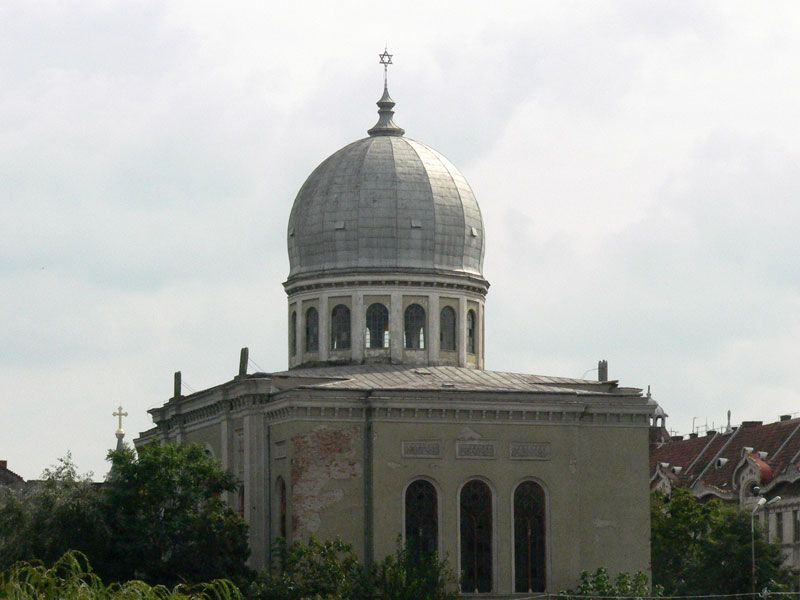
Identify the location of short arched windows. (294, 334), (316, 331), (342, 320), (378, 319), (410, 323), (446, 323), (470, 325).